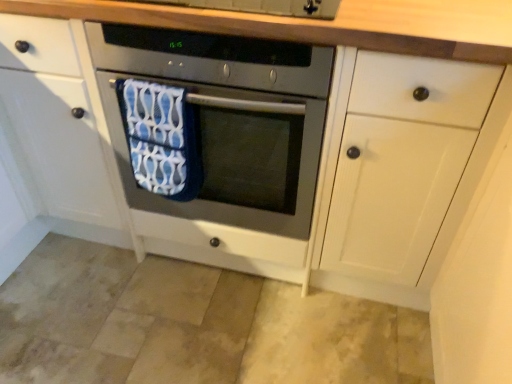
Question: Is blue fabric beach towel at center taller than satin silver oven at center?

Choices:
 (A) yes
 (B) no

Answer: (B)

Question: Does blue fabric beach towel at center have a smaller size compared to satin silver oven at center?

Choices:
 (A) no
 (B) yes

Answer: (B)

Question: Considering the relative positions of blue fabric beach towel at center and satin silver oven at center in the image provided, is blue fabric beach towel at center to the left of satin silver oven at center from the viewer's perspective?

Choices:
 (A) yes
 (B) no

Answer: (A)

Question: Is blue fabric beach towel at center facing away from satin silver oven at center?

Choices:
 (A) yes
 (B) no

Answer: (A)

Question: Considering the relative sizes of blue fabric beach towel at center and satin silver oven at center in the image provided, is blue fabric beach towel at center wider than satin silver oven at center?

Choices:
 (A) no
 (B) yes

Answer: (A)

Question: From a real-world perspective, is blue fabric beach towel at center on satin silver oven at center?

Choices:
 (A) yes
 (B) no

Answer: (A)

Question: Is blue fabric beach towel at center located within satin silver oven at center?

Choices:
 (A) no
 (B) yes

Answer: (B)

Question: Is satin silver oven at center next to blue fabric beach towel at center?

Choices:
 (A) yes
 (B) no

Answer: (B)

Question: Does satin silver oven at center have a lesser height compared to blue fabric beach towel at center?

Choices:
 (A) no
 (B) yes

Answer: (A)

Question: Is satin silver oven at center not within blue fabric beach towel at center?

Choices:
 (A) no
 (B) yes

Answer: (B)

Question: Does satin silver oven at center turn towards blue fabric beach towel at center?

Choices:
 (A) no
 (B) yes

Answer: (B)

Question: Considering the relative sizes of satin silver oven at center and blue fabric beach towel at center in the image provided, is satin silver oven at center bigger than blue fabric beach towel at center?

Choices:
 (A) no
 (B) yes

Answer: (B)

Question: Considering the positions of satin silver oven at center and blue fabric beach towel at center in the image, is satin silver oven at center taller or shorter than blue fabric beach towel at center?

Choices:
 (A) tall
 (B) short

Answer: (A)